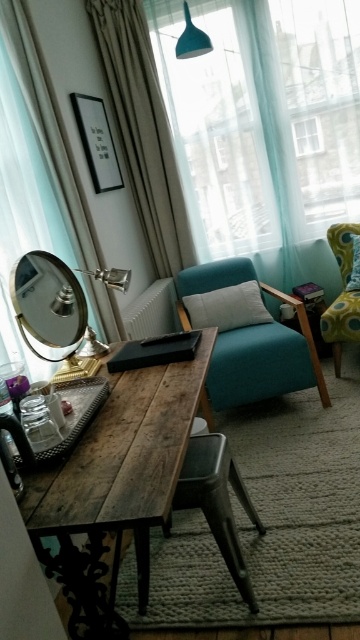
Between point (235, 314) and point (191, 45), which one is positioned behind?

Point (235, 314)

Does light gray fabric pillow at center have a smaller size compared to blue matte lampshade at upper center?

No, light gray fabric pillow at center is not smaller than blue matte lampshade at upper center.

Between point (192, 307) and point (190, 56), which one is positioned behind?

The point (192, 307) is more distant.

I want to click on light gray fabric pillow at center, so click(227, 307).

Can you confirm if green polka dot fabric armchair at right is bigger than blue matte lampshade at upper center?

Yes.

Describe the element at coordinates (342, 294) in the screenshot. The image size is (360, 640). I see `green polka dot fabric armchair at right` at that location.

Find the location of `green polka dot fabric armchair at right`. green polka dot fabric armchair at right is located at coordinates (342, 294).

Is metallic silver chair at center wider than transparent glass window at upper center?

Yes, metallic silver chair at center is wider than transparent glass window at upper center.

The image size is (360, 640). What do you see at coordinates (218, 500) in the screenshot? I see `metallic silver chair at center` at bounding box center [218, 500].

Consider the image. Who is more forward, [250,518] or [308,129]?

Point [250,518] is more forward.

Identify the location of metallic silver chair at center. The width and height of the screenshot is (360, 640). (218, 500).